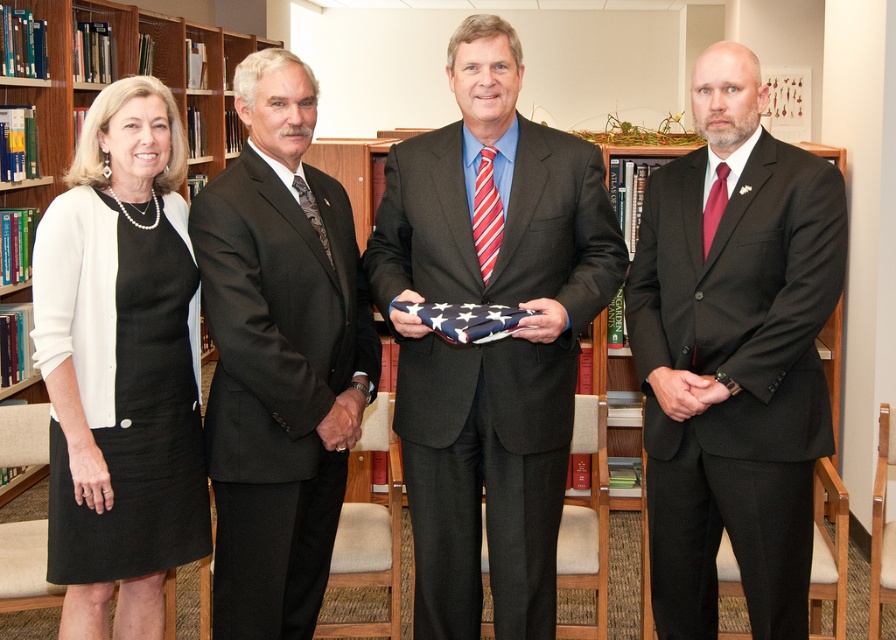
Question: Estimate the real-world distances between objects in this image. Which object is farther from the black suit at center?

Choices:
 (A) matte black suit at center
 (B) white matte dress at left
 (C) matte black suit at right
 (D) wooden bookcase at left

Answer: (D)

Question: Based on their relative distances, which object is nearer to the white matte dress at left?

Choices:
 (A) matte black suit at right
 (B) wooden bookcase at left
 (C) black suit at center

Answer: (C)

Question: Based on their relative distances, which object is farther from the matte black suit at center?

Choices:
 (A) white matte dress at left
 (B) matte black suit at right
 (C) wooden bookcase at left

Answer: (C)

Question: Is matte black suit at right below wooden bookcase at left?

Choices:
 (A) yes
 (B) no

Answer: (A)

Question: Observing the image, what is the correct spatial positioning of black suit at center in reference to wooden bookcase at left?

Choices:
 (A) right
 (B) left

Answer: (A)

Question: Does matte black suit at right appear under white matte dress at left?

Choices:
 (A) yes
 (B) no

Answer: (B)